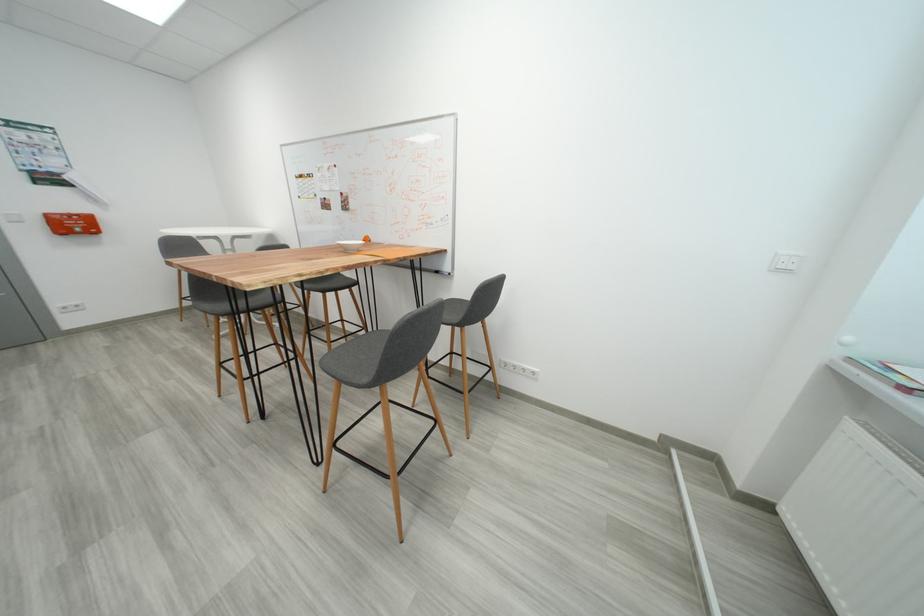
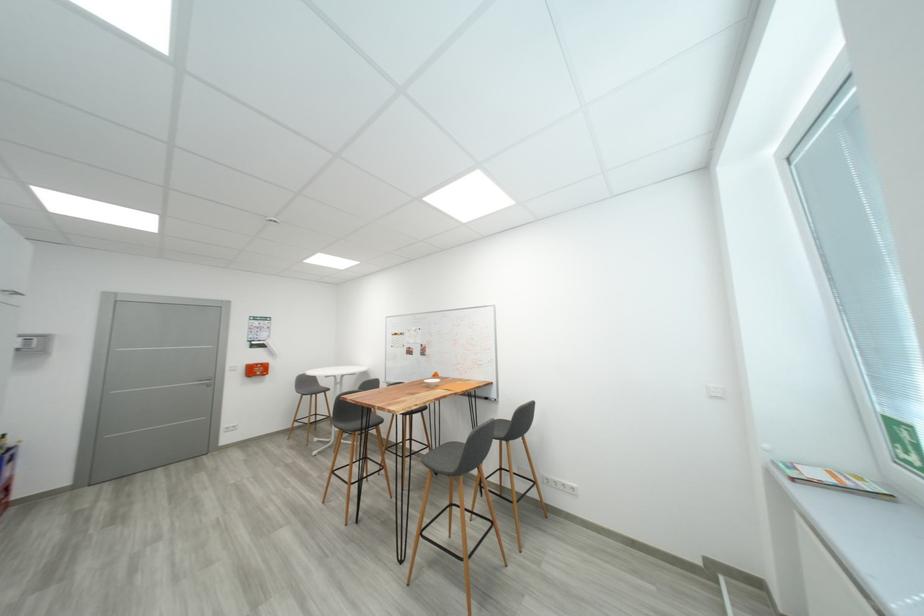
Question: How did the camera likely rotate?

Choices:
 (A) Left
 (B) Right
 (C) Up
 (D) Down

Answer: (C)